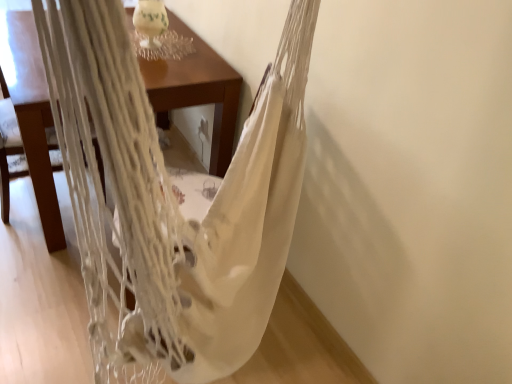
Question: From the image's perspective, is white woven hammock at upper left located above wooden table at center?

Choices:
 (A) yes
 (B) no

Answer: (B)

Question: Can you confirm if white woven hammock at upper left is taller than wooden table at center?

Choices:
 (A) no
 (B) yes

Answer: (B)

Question: Can you confirm if white woven hammock at upper left is smaller than wooden table at center?

Choices:
 (A) no
 (B) yes

Answer: (B)

Question: Is white woven hammock at upper left positioned far away from wooden table at center?

Choices:
 (A) yes
 (B) no

Answer: (A)

Question: Is wooden table at center surrounded by white woven hammock at upper left?

Choices:
 (A) yes
 (B) no

Answer: (B)

Question: In terms of width, does white woven hammock at upper left look wider or thinner when compared to white macrame hammock at center?

Choices:
 (A) wide
 (B) thin

Answer: (B)

Question: Is white woven hammock at upper left to the left or to the right of white macrame hammock at center in the image?

Choices:
 (A) right
 (B) left

Answer: (B)

Question: Considering the positions of white woven hammock at upper left and white macrame hammock at center in the image, is white woven hammock at upper left taller or shorter than white macrame hammock at center?

Choices:
 (A) short
 (B) tall

Answer: (A)

Question: In terms of size, does white woven hammock at upper left appear bigger or smaller than white macrame hammock at center?

Choices:
 (A) small
 (B) big

Answer: (A)

Question: Choose the correct answer: Is wooden table at center inside white woven hammock at upper left or outside it?

Choices:
 (A) inside
 (B) outside

Answer: (B)

Question: Is point (41, 130) positioned closer to the camera than point (7, 107)?

Choices:
 (A) farther
 (B) closer

Answer: (B)

Question: In terms of height, does wooden table at center look taller or shorter compared to white woven hammock at upper left?

Choices:
 (A) short
 (B) tall

Answer: (A)

Question: In terms of size, does wooden table at center appear bigger or smaller than white woven hammock at upper left?

Choices:
 (A) small
 (B) big

Answer: (B)

Question: Looking at the image, does white macrame hammock at center seem bigger or smaller compared to white woven hammock at upper left?

Choices:
 (A) big
 (B) small

Answer: (A)

Question: Looking at their shapes, would you say white macrame hammock at center is wider or thinner than white woven hammock at upper left?

Choices:
 (A) thin
 (B) wide

Answer: (B)